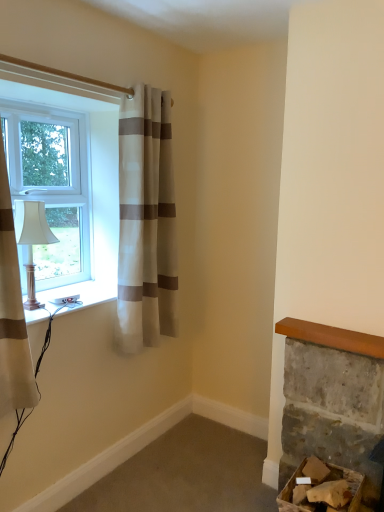
Question: Would you say matte white lamp at left is to the left or to the right of cardboard box at lower right in the picture?

Choices:
 (A) left
 (B) right

Answer: (A)

Question: Is point (38, 224) closer or farther from the camera than point (349, 480)?

Choices:
 (A) closer
 (B) farther

Answer: (B)

Question: Which is farther from the white plastic socket at lower left?

Choices:
 (A) cardboard box at lower right
 (B) white plastic window at left
 (C) matte white lamp at left
 (D) rough stone fireplace at lower right
 (E) white striped curtain at left, the 2th curtain viewed from the right

Answer: (A)

Question: Estimate the real-world distances between objects in this image. Which object is closer to the matte white lamp at left?

Choices:
 (A) white plastic socket at lower left
 (B) cardboard box at lower right
 (C) rough stone fireplace at lower right
 (D) white striped curtain at upper left, marked as the second curtain in a front-to-back arrangement
 (E) white plastic window at left

Answer: (A)